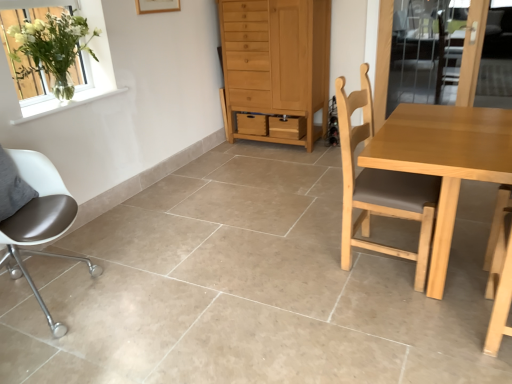
Question: Is the depth of light brown wood cabinet at center less than that of light brown wood chair at center, the 1th chair in the right-to-left sequence?

Choices:
 (A) no
 (B) yes

Answer: (A)

Question: Does light brown wood cabinet at center have a greater width compared to light brown wood chair at center, the 1th chair in the right-to-left sequence?

Choices:
 (A) no
 (B) yes

Answer: (B)

Question: Is light brown wood cabinet at center thinner than light brown wood chair at center, positioned as the second chair in left-to-right order?

Choices:
 (A) no
 (B) yes

Answer: (A)

Question: Is light brown wood cabinet at center to the left of light brown wood chair at center, the 1th chair in the right-to-left sequence, from the viewer's perspective?

Choices:
 (A) yes
 (B) no

Answer: (A)

Question: Can you confirm if light brown wood cabinet at center is positioned to the right of light brown wood chair at center, the 1th chair in the right-to-left sequence?

Choices:
 (A) no
 (B) yes

Answer: (A)

Question: From a real-world perspective, is light brown wood cabinet at center physically above light brown wood chair at center, the 1th chair in the right-to-left sequence?

Choices:
 (A) no
 (B) yes

Answer: (B)

Question: Can you confirm if light brown wood chair at center, positioned as the second chair in left-to-right order, is taller than light brown wood cabinet at center?

Choices:
 (A) yes
 (B) no

Answer: (B)

Question: Is light brown wood chair at center, the 1th chair in the right-to-left sequence, positioned before light brown wood cabinet at center?

Choices:
 (A) yes
 (B) no

Answer: (A)

Question: Is light brown wood chair at center, the 1th chair in the right-to-left sequence, facing towards light brown wood cabinet at center?

Choices:
 (A) no
 (B) yes

Answer: (A)

Question: Is light brown wood chair at center, the 1th chair in the right-to-left sequence, to the left of light brown wood cabinet at center from the viewer's perspective?

Choices:
 (A) yes
 (B) no

Answer: (B)

Question: From the image's perspective, is light brown wood chair at center, positioned as the second chair in left-to-right order, over light brown wood cabinet at center?

Choices:
 (A) no
 (B) yes

Answer: (A)

Question: Can you confirm if light brown wood chair at center, positioned as the second chair in left-to-right order, is bigger than light brown wood cabinet at center?

Choices:
 (A) no
 (B) yes

Answer: (A)

Question: Is light brown wooden table at right positioned with its back to clear glass screen door at upper right?

Choices:
 (A) yes
 (B) no

Answer: (A)